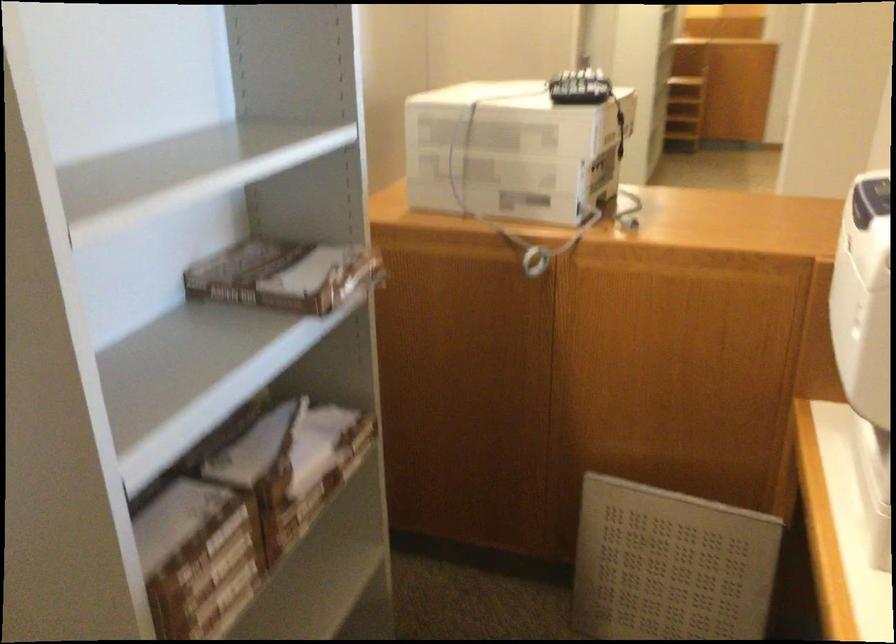
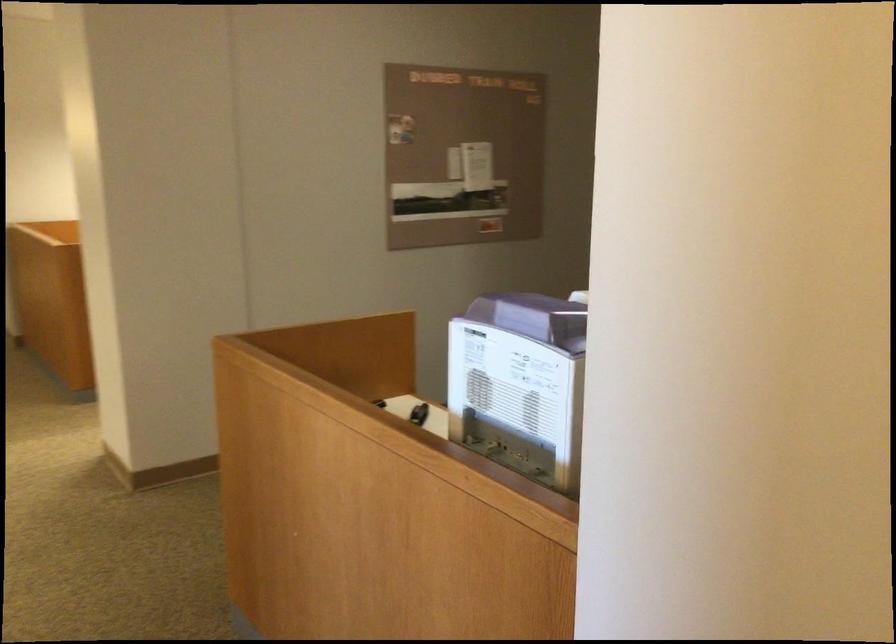
Question: I am providing you with two images of the same scene from different viewpoints. After the viewpoint changes to image2, which objects are now occluded?

Choices:
 (A) brown cardboard box
 (B) purple machine lid
 (C) serving dish handle
 (D) small black object

Answer: (A)